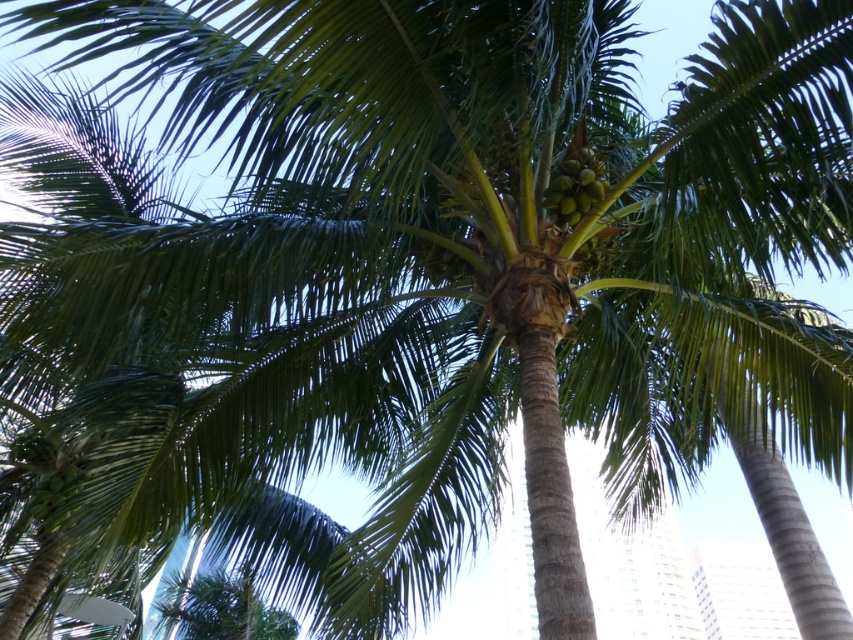
You are a coconut collector standing at the base of the palm tree. You see two clusters of green matte coconuts at center and green matte coconuts at lower left. Which cluster is located to the right of the other?

The green matte coconuts at center is positioned on the right side of green matte coconuts at lower left.

You are a bird flying above the tropical palm trees. You spot two groups of green matte coconuts at center and green matte coconuts at lower left. Which group is closer to the ground?

The green matte coconuts at lower left are closer to the ground since they are shorter than the green matte coconuts at center.